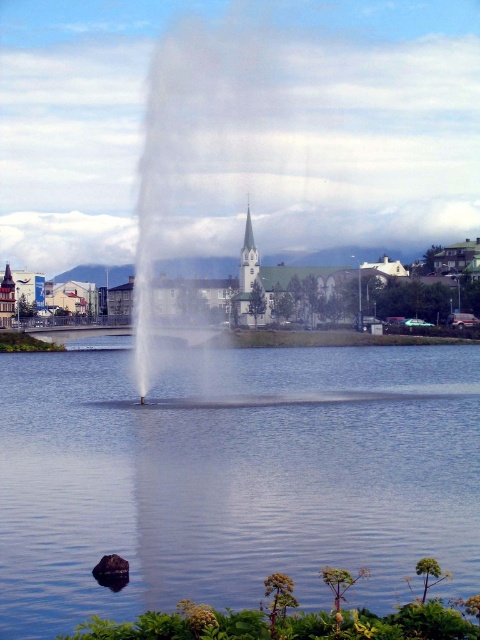
Does transparent water at center have a greater width compared to white stone spire at center?

Correct, the width of transparent water at center exceeds that of white stone spire at center.

Based on the photo, can you confirm if transparent water at center is taller than white stone spire at center?

Incorrect, transparent water at center's height is not larger of white stone spire at center's.

Identify the location of transparent water at center. [x=231, y=476].